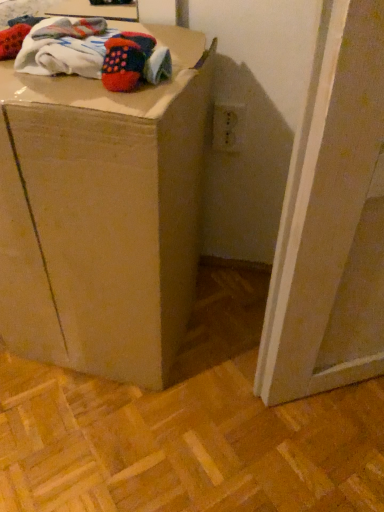
Question: Is brown cardboard box at center to the left or to the right of knitted wool socks at upper left in the image?

Choices:
 (A) left
 (B) right

Answer: (A)

Question: From the image's perspective, relative to knitted wool socks at upper left, is brown cardboard box at center above or below?

Choices:
 (A) above
 (B) below

Answer: (B)

Question: Considering the positions of brown cardboard box at center and knitted wool socks at upper left in the image, is brown cardboard box at center wider or thinner than knitted wool socks at upper left?

Choices:
 (A) wide
 (B) thin

Answer: (A)

Question: Would you say knitted wool socks at upper left is to the left or to the right of brown cardboard box at center in the picture?

Choices:
 (A) left
 (B) right

Answer: (B)

Question: From the image's perspective, is knitted wool socks at upper left located above or below brown cardboard box at center?

Choices:
 (A) below
 (B) above

Answer: (B)

Question: From a real-world perspective, relative to brown cardboard box at center, is knitted wool socks at upper left vertically above or below?

Choices:
 (A) below
 (B) above

Answer: (B)

Question: Is knitted wool socks at upper left situated inside brown cardboard box at center or outside?

Choices:
 (A) outside
 (B) inside

Answer: (B)